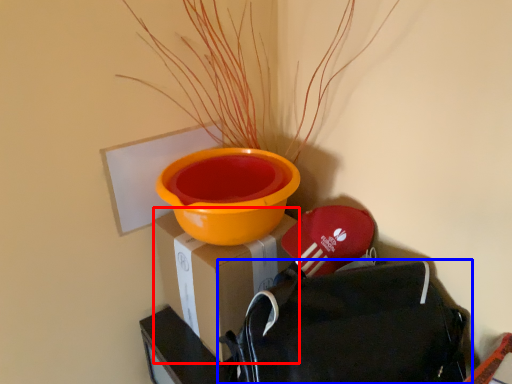
Question: Which object is closer to the camera taking this photo, cardboard box (highlighted by a red box) or backpack (highlighted by a blue box)?

Choices:
 (A) cardboard box
 (B) backpack

Answer: (B)